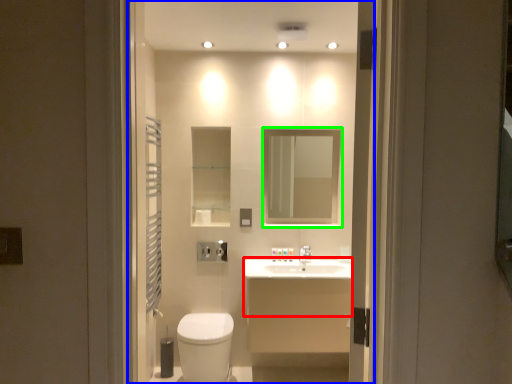
Question: Based on their relative distances, which object is farther from counter top (highlighted by a red box)? Choose from residence (highlighted by a blue box) and mirror (highlighted by a green box).

Choices:
 (A) residence
 (B) mirror

Answer: (B)